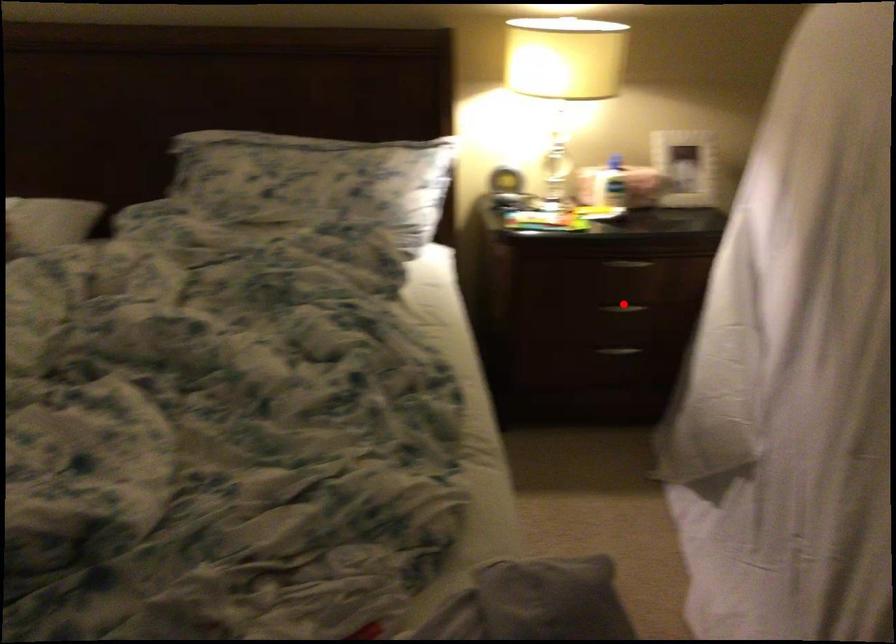
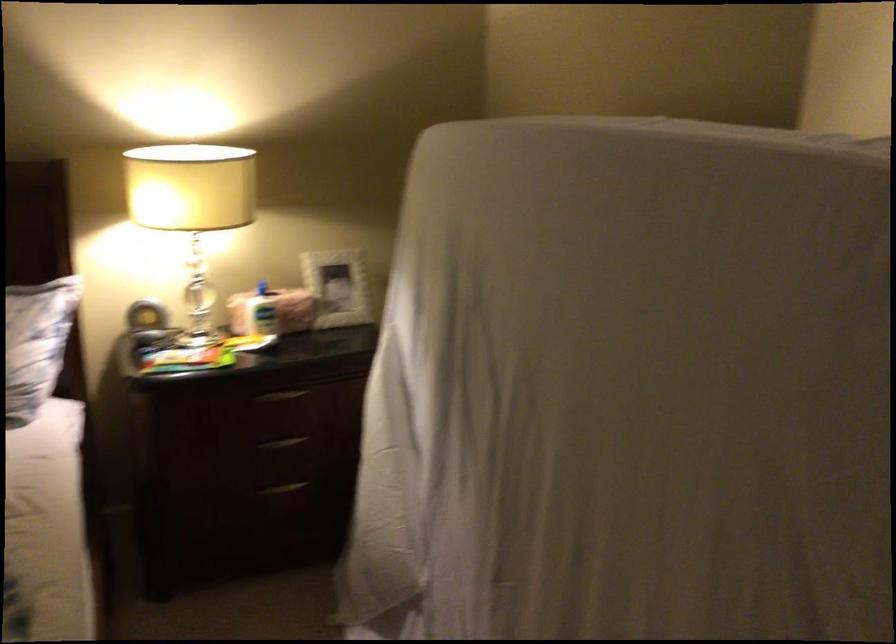
In the second image, find the point that corresponds to the highlighted location in the first image.

(282, 442)